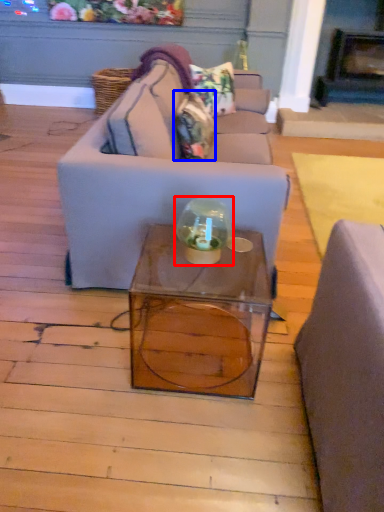
Question: Which point is further to the camera, glass jar (highlighted by a red box) or pillow (highlighted by a blue box)?

Choices:
 (A) glass jar
 (B) pillow

Answer: (B)